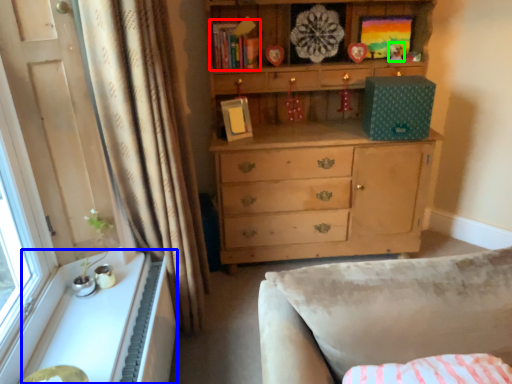
Question: Estimate the real-world distances between objects in this image. Which object is closer to book (highlighted by a red box), cabinetry (highlighted by a blue box) or toy (highlighted by a green box)?

Choices:
 (A) cabinetry
 (B) toy

Answer: (B)